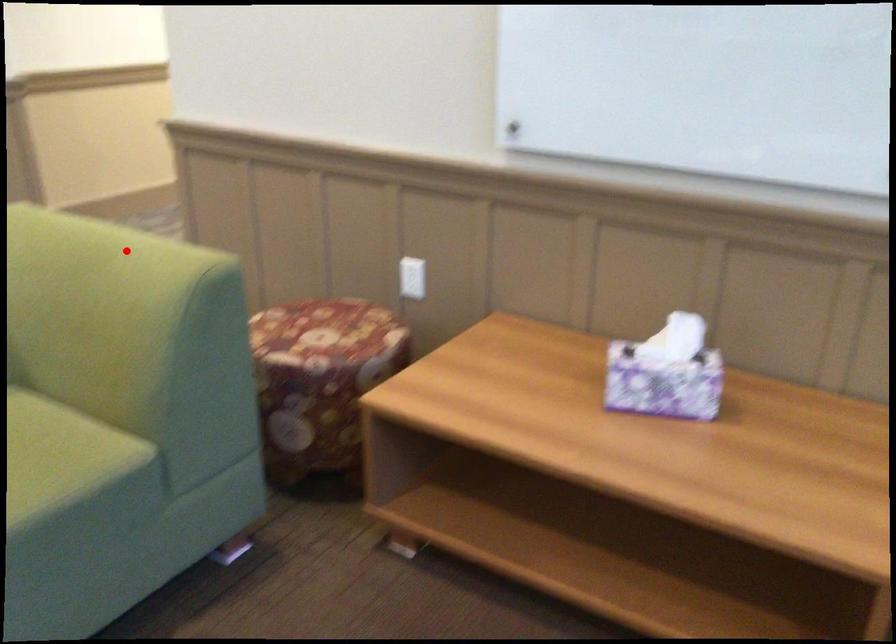
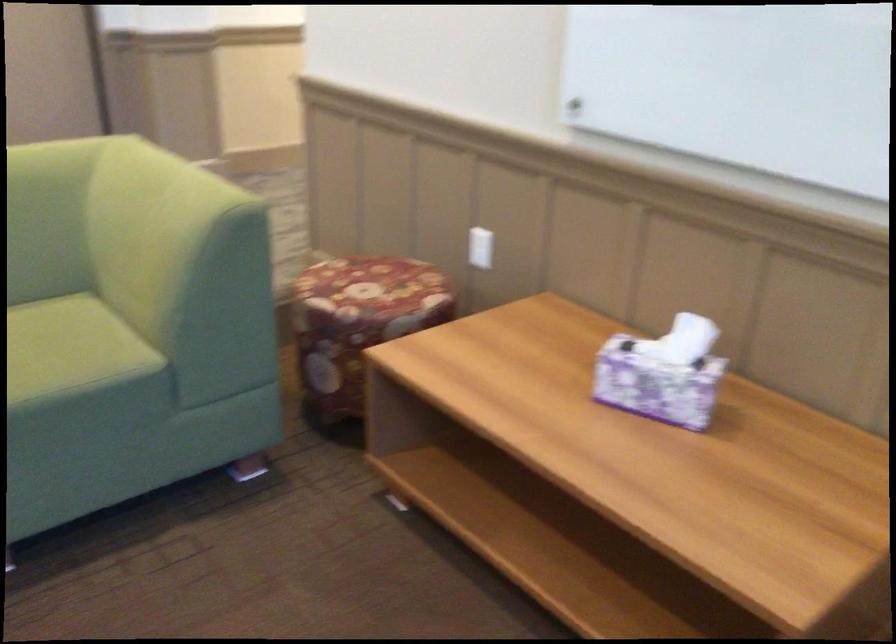
Question: A red point is marked in image1. In image2, is the corresponding 3D point closer to the camera or farther? Reply with the corresponding letter.

Choices:
 (A) The corresponding 3D point is closer.
 (B) The corresponding 3D point is farther.

Answer: (B)